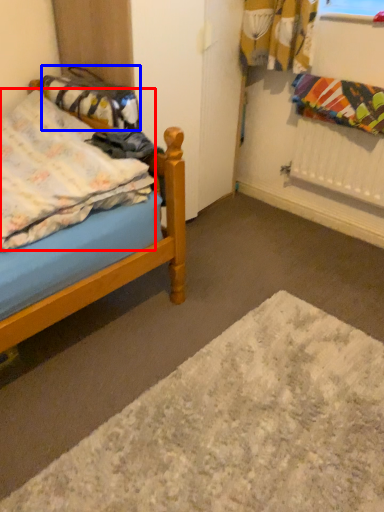
Question: Which object appears farthest to the camera in this image, blanket (highlighted by a red box) or material (highlighted by a blue box)?

Choices:
 (A) blanket
 (B) material

Answer: (B)